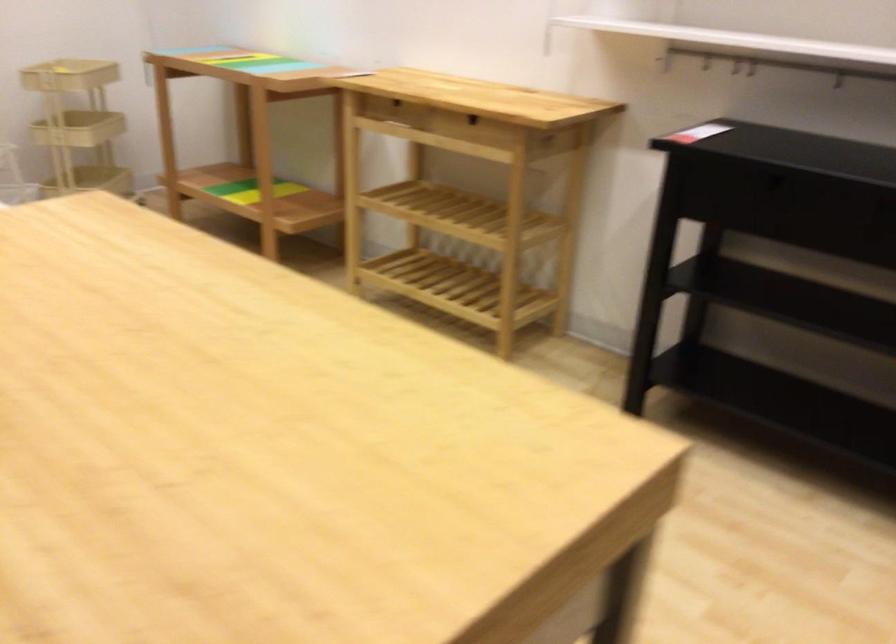
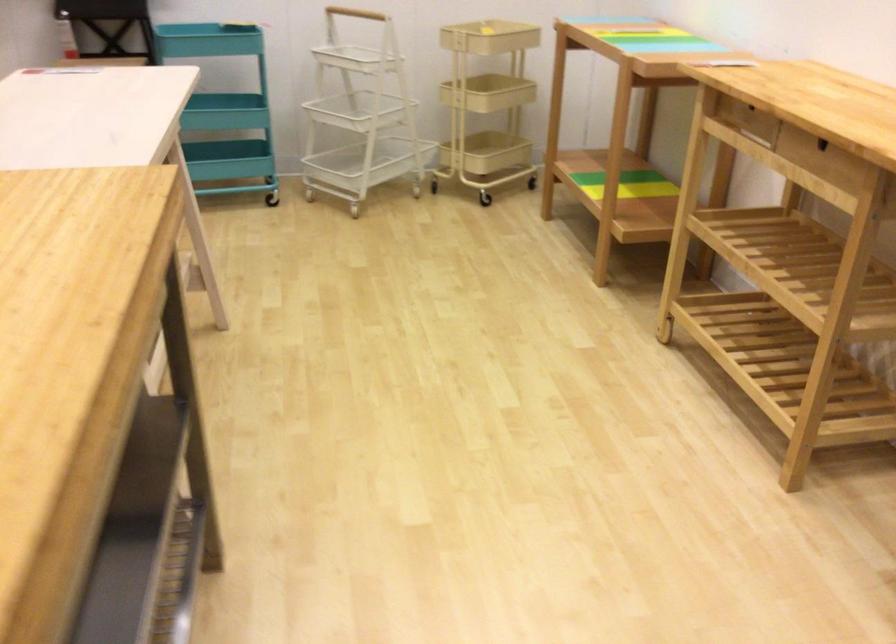
Question: The images are taken continuously from a first-person perspective. In which direction is your viewpoint rotating?

Choices:
 (A) Left
 (B) Right
 (C) Up
 (D) Down

Answer: (A)